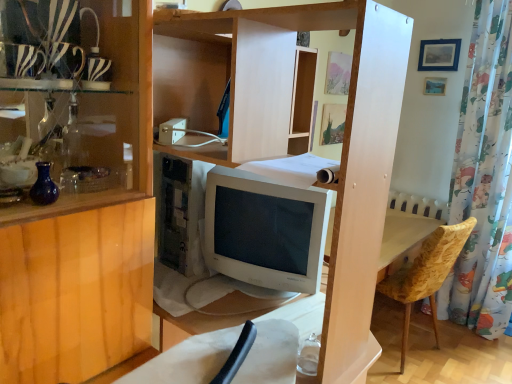
This screenshot has width=512, height=384. Describe the element at coordinates (439, 55) in the screenshot. I see `blue matte picture frame at upper right` at that location.

Measure the distance between point [452,247] and camera.

Point [452,247] and camera are 2.10 meters apart from each other.

The image size is (512, 384). I want to click on floral fabric shower curtain at right, so click(x=484, y=179).

This screenshot has width=512, height=384. I want to click on zebra-patterned glass at upper left, so click(51, 46).

From a real-world perspective, is blue glass vase at left below floral fabric shower curtain at right?

Incorrect, from a real-world perspective, blue glass vase at left is higher than floral fabric shower curtain at right.

Where is `glass vase that is below the floral fabric shower curtain at right (from the image's perspective)`? The height and width of the screenshot is (384, 512). glass vase that is below the floral fabric shower curtain at right (from the image's perspective) is located at coordinates (44, 186).

From the image's perspective, between blue glass vase at left and floral fabric shower curtain at right, who is located below?

blue glass vase at left appears lower in the image.

Looking at this image, is floral fabric shower curtain at right located within blue glass vase at left?

No, blue glass vase at left does not contain floral fabric shower curtain at right.

Is zebra-patterned glass at upper left oriented towards blue matte picture frame at upper right?

No, zebra-patterned glass at upper left is not turned towards blue matte picture frame at upper right.

Considering the relative sizes of zebra-patterned glass at upper left and blue matte picture frame at upper right in the image provided, is zebra-patterned glass at upper left thinner than blue matte picture frame at upper right?

Incorrect, the width of zebra-patterned glass at upper left is not less than that of blue matte picture frame at upper right.

Is zebra-patterned glass at upper left located outside blue matte picture frame at upper right?

Yes, zebra-patterned glass at upper left is located beyond the bounds of blue matte picture frame at upper right.

The height and width of the screenshot is (384, 512). Find the location of `picture frame positioned vertically above the zebra-patterned glass at upper left (from a real-world perspective)`. picture frame positioned vertically above the zebra-patterned glass at upper left (from a real-world perspective) is located at coordinates (439, 55).

Looking at this image, is blue matte picture frame at upper right oriented away from white glossy computer monitor at center?

blue matte picture frame at upper right does not have its back to white glossy computer monitor at center.

Between blue matte picture frame at upper right and white glossy computer monitor at center, which one appears on the left side from the viewer's perspective?

From the viewer's perspective, white glossy computer monitor at center appears more on the left side.

Considering the positions of objects blue matte picture frame at upper right and white glossy computer monitor at center in the image provided, who is in front, blue matte picture frame at upper right or white glossy computer monitor at center?

white glossy computer monitor at center is more forward.

In terms of size, does blue glass vase at left appear bigger or smaller than zebra-patterned glass at upper left?

Considering their sizes, blue glass vase at left takes up less space than zebra-patterned glass at upper left.

Is blue glass vase at left aimed at zebra-patterned glass at upper left?

No, blue glass vase at left is not turned towards zebra-patterned glass at upper left.

How distant is blue glass vase at left from zebra-patterned glass at upper left?

blue glass vase at left is 11.47 inches from zebra-patterned glass at upper left.

Is blue glass vase at left not inside zebra-patterned glass at upper left?

Yes, blue glass vase at left is located beyond the bounds of zebra-patterned glass at upper left.

Which object is positioned more to the right, zebra-patterned glass at upper left or velvet yellow chair at lower right?

Positioned to the right is velvet yellow chair at lower right.

Which is behind, point (127, 88) or point (446, 266)?

Point (446, 266)

How many degrees apart are the facing directions of zebra-patterned glass at upper left and velvet yellow chair at lower right?

The angle between the facing direction of zebra-patterned glass at upper left and the facing direction of velvet yellow chair at lower right is 166 degrees.

Do you think zebra-patterned glass at upper left is within velvet yellow chair at lower right, or outside of it?

zebra-patterned glass at upper left is spatially situated outside velvet yellow chair at lower right.

Could you tell me if zebra-patterned glass at upper left is facing blue glass vase at left?

No, zebra-patterned glass at upper left does not turn towards blue glass vase at left.

In the scene shown: Is zebra-patterned glass at upper left in contact with blue glass vase at left?

There is a gap between zebra-patterned glass at upper left and blue glass vase at left.

From the image's perspective, is zebra-patterned glass at upper left above blue glass vase at left?

Yes, from the image's perspective, zebra-patterned glass at upper left is on top of blue glass vase at left.

Considering the positions of objects white glossy computer monitor at center and floral fabric shower curtain at right in the image provided, who is behind, white glossy computer monitor at center or floral fabric shower curtain at right?

floral fabric shower curtain at right is further away from the camera.

From a real-world perspective, is white glossy computer monitor at center positioned under floral fabric shower curtain at right based on gravity?

Indeed, from a real-world perspective, white glossy computer monitor at center is positioned beneath floral fabric shower curtain at right.

You are a GUI agent. You are given a task and a screenshot of the screen. Output one action in this format:
    pyautogui.click(x=<x>, y=<y>)
    Task: Click on the computer monitor below the floral fabric shower curtain at right (from the image's perspective)
    
    Given the screenshot: What is the action you would take?
    pyautogui.click(x=265, y=232)

Measure the distance between white glossy computer monitor at center and floral fabric shower curtain at right.

They are 1.76 meters apart.

Identify the location of shower curtain lying above the blue glass vase at left (from the image's perspective). (484, 179).

Find the location of a particular element. shelf below the blue matte picture frame at upper right (from a real-world perspective) is located at coordinates (51, 46).

When comparing their distances from velvet yellow chair at lower right, does floral fabric shower curtain at right or blue glass vase at left seem closer?

floral fabric shower curtain at right.

From the image, which object appears to be farther from blue glass vase at left, white glossy computer monitor at center or blue matte picture frame at upper right?

Based on the image, blue matte picture frame at upper right appears to be further to blue glass vase at left.

Which object lies nearer to the anchor point blue glass vase at left, floral fabric shower curtain at right or white glossy computer monitor at center?

Among the two, white glossy computer monitor at center is located nearer to blue glass vase at left.

Based on their spatial positions, is white glossy computer monitor at center or velvet yellow chair at lower right closer to zebra-patterned glass at upper left?

white glossy computer monitor at center lies closer to zebra-patterned glass at upper left than the other object.

When comparing their distances from floral fabric shower curtain at right, does white glossy computer monitor at center or blue matte picture frame at upper right seem closer?

blue matte picture frame at upper right is closer to floral fabric shower curtain at right.

Looking at this image, considering their positions, is blue glass vase at left positioned closer to floral fabric shower curtain at right than velvet yellow chair at lower right?

velvet yellow chair at lower right is positioned closer to the anchor floral fabric shower curtain at right.

Considering their positions, is floral fabric shower curtain at right positioned closer to velvet yellow chair at lower right than zebra-patterned glass at upper left?

Based on the image, floral fabric shower curtain at right appears to be nearer to velvet yellow chair at lower right.

Considering their positions, is blue glass vase at left positioned closer to floral fabric shower curtain at right than zebra-patterned glass at upper left?

The object closer to floral fabric shower curtain at right is zebra-patterned glass at upper left.

Find the location of `chair located between zebra-patterned glass at upper left and blue matte picture frame at upper right in the depth direction`. chair located between zebra-patterned glass at upper left and blue matte picture frame at upper right in the depth direction is located at coordinates (425, 276).

I want to click on glass vase situated between zebra-patterned glass at upper left and floral fabric shower curtain at right from left to right, so click(44, 186).

Identify the location of computer monitor between blue glass vase at left and blue matte picture frame at upper right along the z-axis. (265, 232).

What are the coordinates of `chair between blue glass vase at left and blue matte picture frame at upper right from front to back` in the screenshot? It's located at (425, 276).